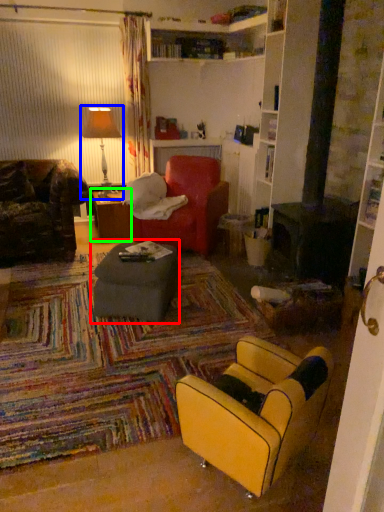
Question: Which is nearer to the table (highlighted by a red box)? table lamp (highlighted by a blue box) or table (highlighted by a green box).

Choices:
 (A) table lamp
 (B) table

Answer: (B)